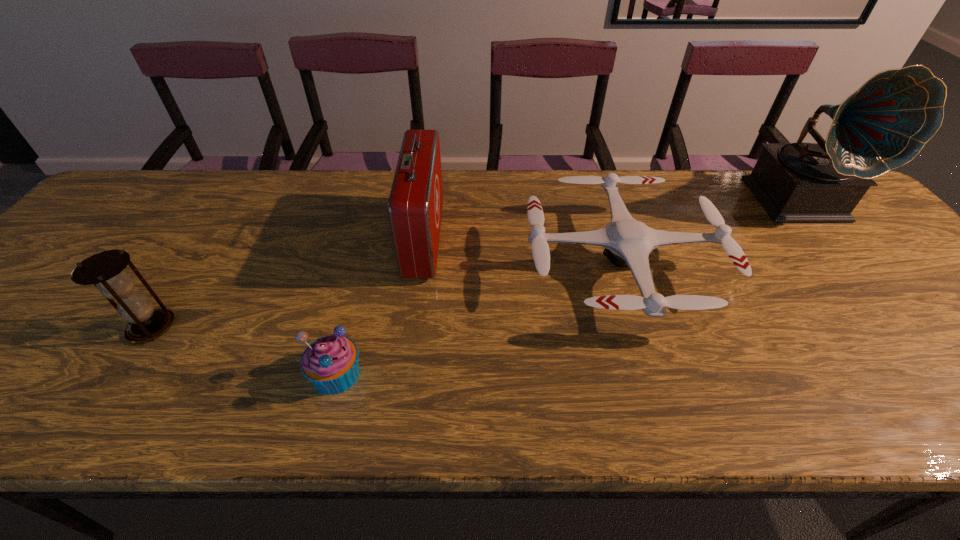
The height and width of the screenshot is (540, 960). In order to click on vacant area in the image that satisfies the following two spatial constraints: 1. on the horn of the tallest object; 2. on the side of the second tallest object with the first aid cross symbol in this screenshot , I will do `click(833, 239)`.